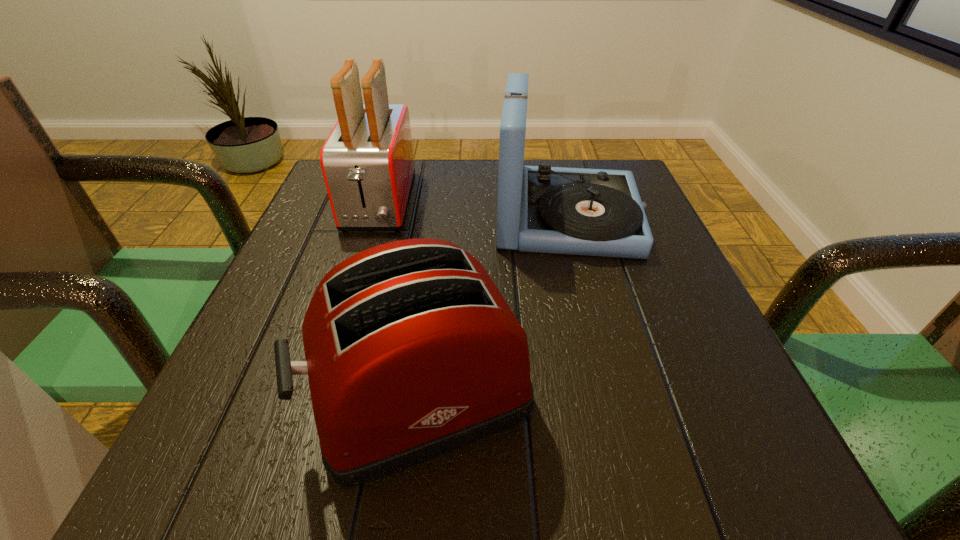
Identify the location of vacant area that lies between the farther toaster and the phonograph record. The image size is (960, 540). (473, 209).

What are the coordinates of `the second closest object relative to the nearest object` in the screenshot? It's located at (367, 161).

Select which object is the second closest to the phonograph record. Please provide its 2D coordinates. Your answer should be formatted as a tuple, i.e. [(x, y)], where the tuple contains the x and y coordinates of a point satisfying the conditions above.

[(367, 161)]

Identify the location of free space that satisfies the following two spatial constraints: 1. on the front-facing side of the phonograph record; 2. on the left side of the taller toaster. (374, 216).

Where is `vacant space that satisfies the following two spatial constraints: 1. on the front-facing side of the farther toaster; 2. on the left side of the phonograph record`? This screenshot has width=960, height=540. vacant space that satisfies the following two spatial constraints: 1. on the front-facing side of the farther toaster; 2. on the left side of the phonograph record is located at coordinates (374, 216).

The width and height of the screenshot is (960, 540). I want to click on free location that satisfies the following two spatial constraints: 1. on the front-facing side of the taller toaster; 2. on the right side of the phonograph record, so click(x=374, y=216).

I want to click on blank space that satisfies the following two spatial constraints: 1. on the front-facing side of the farther toaster; 2. on the left side of the shorter toaster, so click(x=319, y=395).

Where is `free location that satisfies the following two spatial constraints: 1. on the front-facing side of the farther toaster; 2. on the left side of the phonograph record`? free location that satisfies the following two spatial constraints: 1. on the front-facing side of the farther toaster; 2. on the left side of the phonograph record is located at coordinates (374, 216).

Find the location of a particular element. The height and width of the screenshot is (540, 960). vacant space that satisfies the following two spatial constraints: 1. on the front-facing side of the taller toaster; 2. on the right side of the phonograph record is located at coordinates (374, 216).

Image resolution: width=960 pixels, height=540 pixels. I want to click on free space that satisfies the following two spatial constraints: 1. on the front-facing side of the shortest object; 2. on the right side of the farther toaster, so click(x=319, y=395).